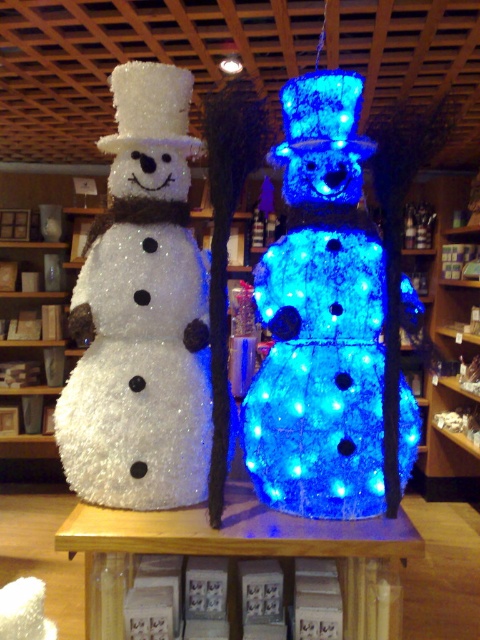
Consider the image. Is blue led-lit snowman at center to the left of white glittery snowman at left from the viewer's perspective?

No, blue led-lit snowman at center is not to the left of white glittery snowman at left.

Can you confirm if blue led-lit snowman at center is shorter than white glittery snowman at left?

Correct, blue led-lit snowman at center is not as tall as white glittery snowman at left.

Does point (292, 257) come in front of point (183, 168)?

Yes, point (292, 257) is in front of point (183, 168).

Image resolution: width=480 pixels, height=640 pixels. Identify the location of blue led-lit snowman at center. (320, 317).